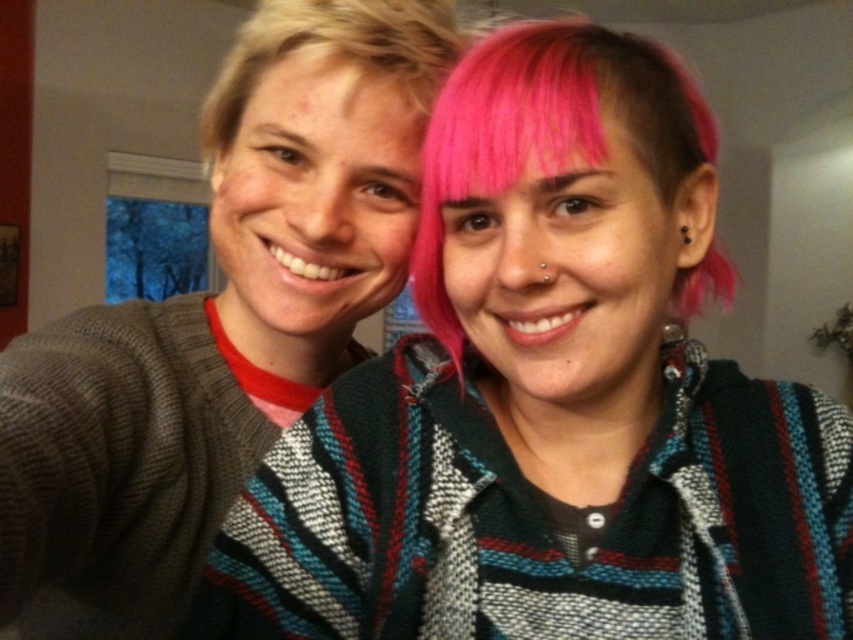
Consider the image. You are taking a photo of two people standing at point (71, 348) and point (402, 33). Which person is closer to the camera?

The person at point (71, 348) is closer to the camera because it is in front of point (402, 33).

You are taking a selfie with two friends. You notice two points in the image at coordinates point (407, 618) and point (225, 77). Which point is nearer to you?

Point (407, 618) is closer to the viewer than point (225, 77).